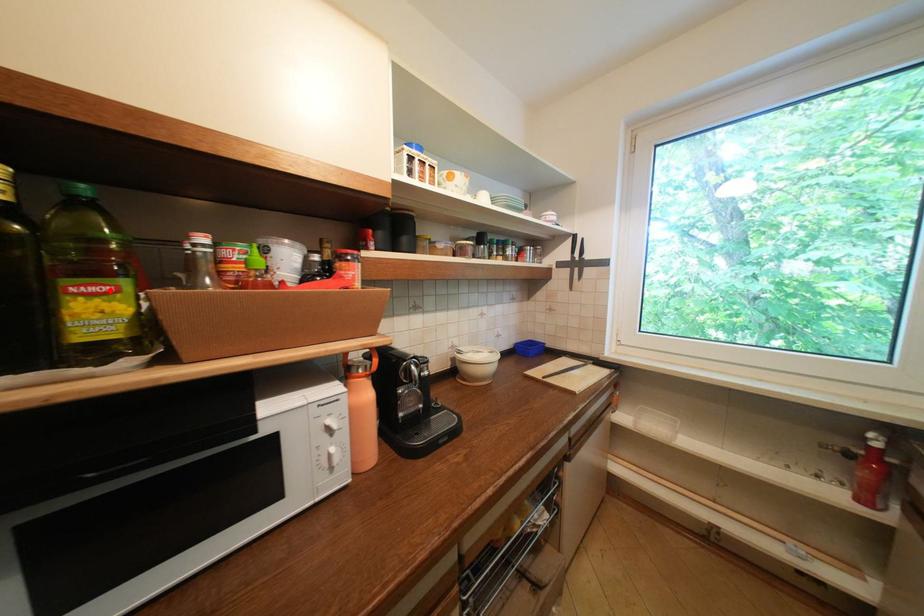
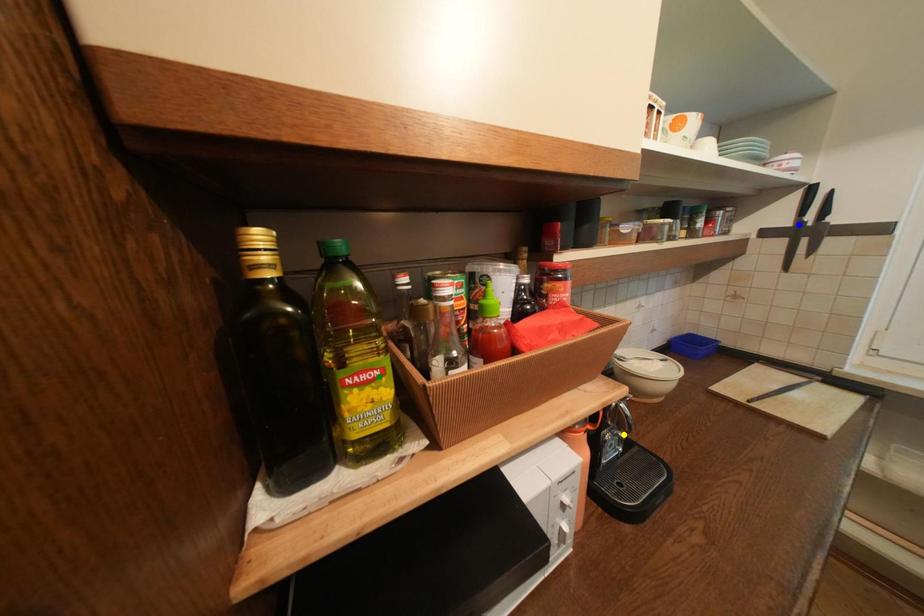
Question: I am providing you with two images of the same scene from different viewpoints. A red point is marked on the first image. You are given multiple points on the second image. Which spot in image 2 lines up with the point in image 1?

Choices:
 (A) blue point
 (B) green point
 (C) yellow point

Answer: (B)